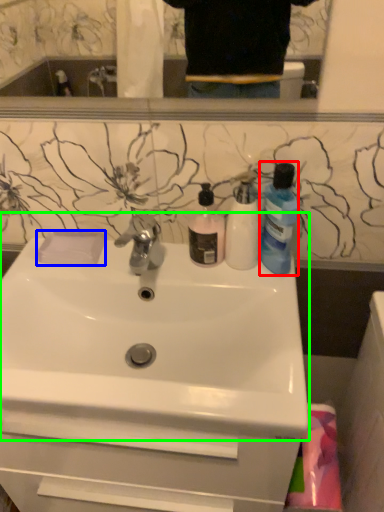
Question: Which object is the farthest from cleaning product (highlighted by a red box)? Choose among these: soap (highlighted by a blue box) or sink (highlighted by a green box).

Choices:
 (A) soap
 (B) sink

Answer: (A)